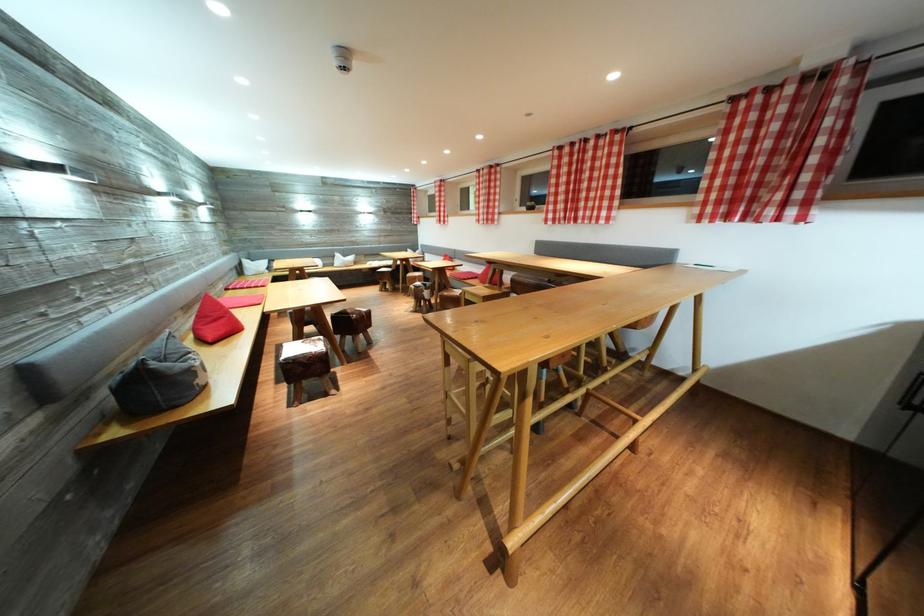
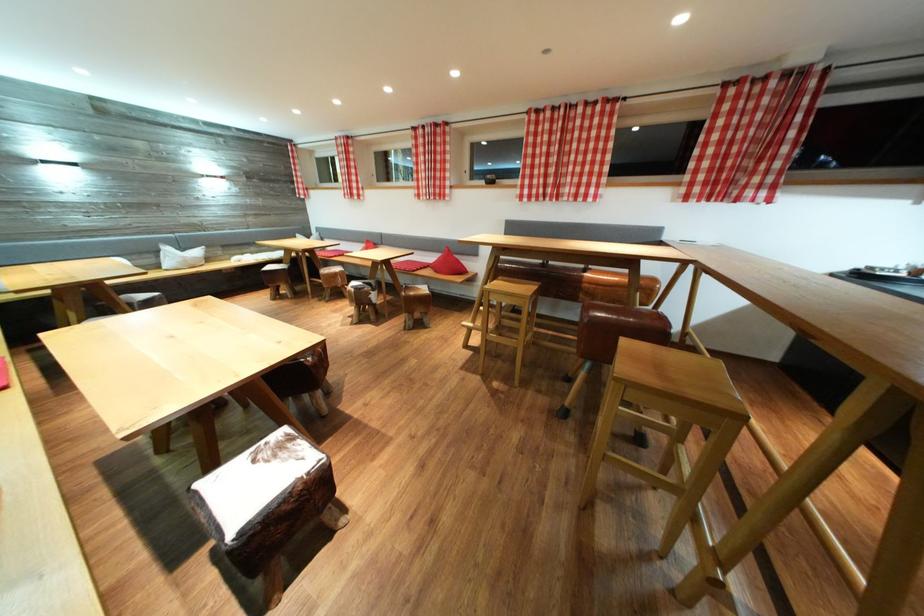
Which direction would the cameraman need to move to produce the second image?

The movement direction of the cameraman is left, forward.